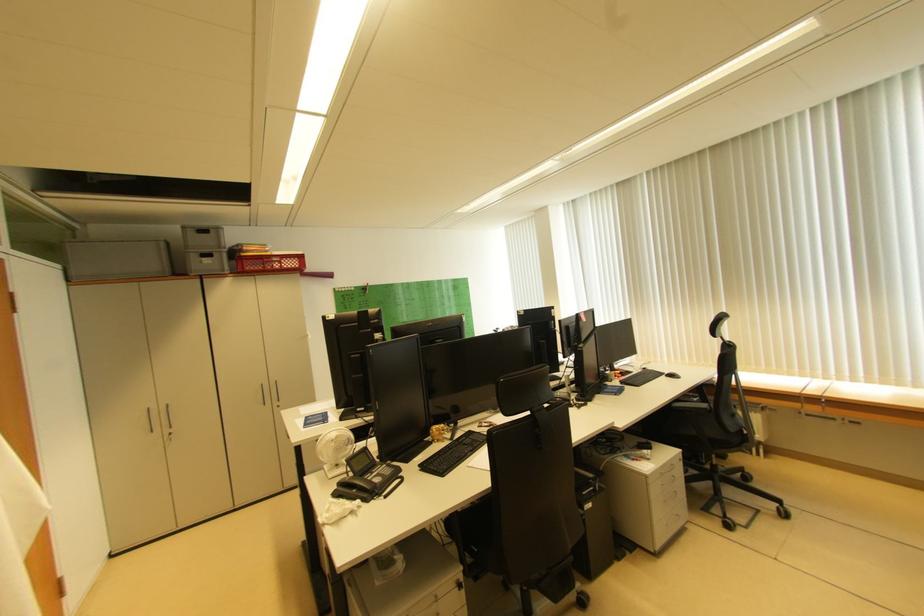
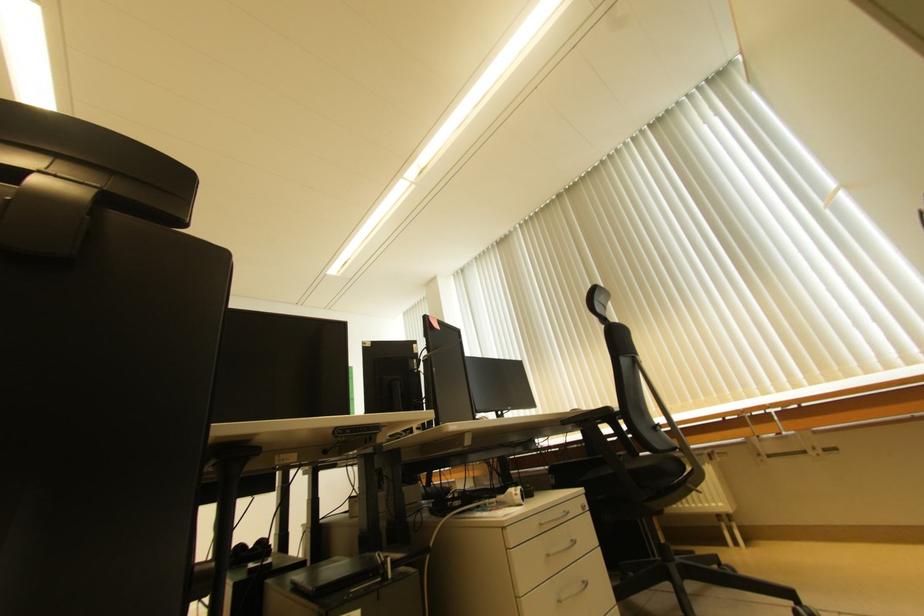
What movement of the cameraman would produce the second image?

The cameraman moved toward right, forward.